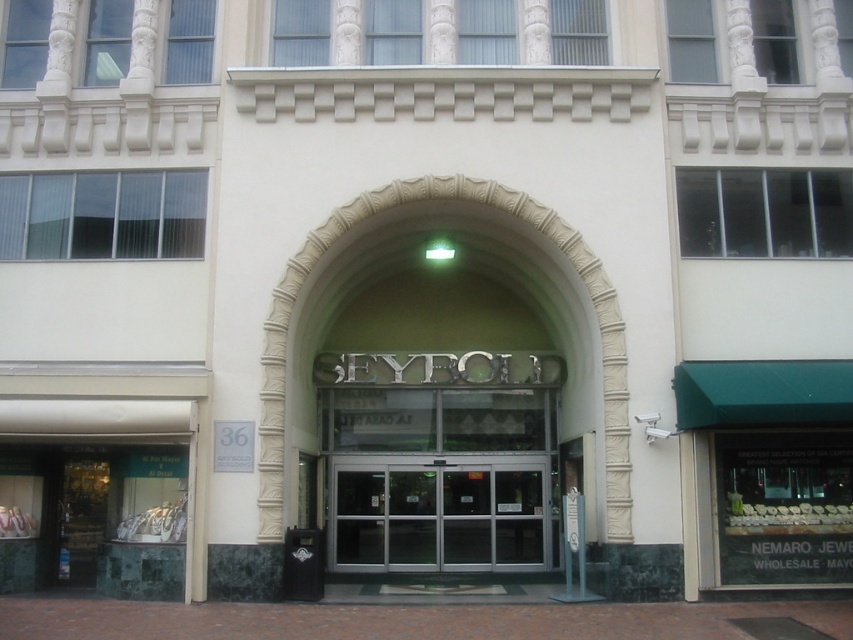
Based on the photo, you are standing in front of the entrance of the building. You need to enter through the transparent glass doors at center. Which direction should you walk relative to the white stone archway at center?

You should walk downward towards the transparent glass doors at center since they are located below the white stone archway at center.

You are an architect designing a new building entrance. You want to place a decorative element between the green marble display case at lower left and the white stone archway at center. Given their widths, which object should the decorative element be placed closer to?

The decorative element should be placed closer to the white stone archway at center because the green marble display case at lower left is wider. This ensures the decorative element can be positioned in a balanced manner between the two objects based on their widths.